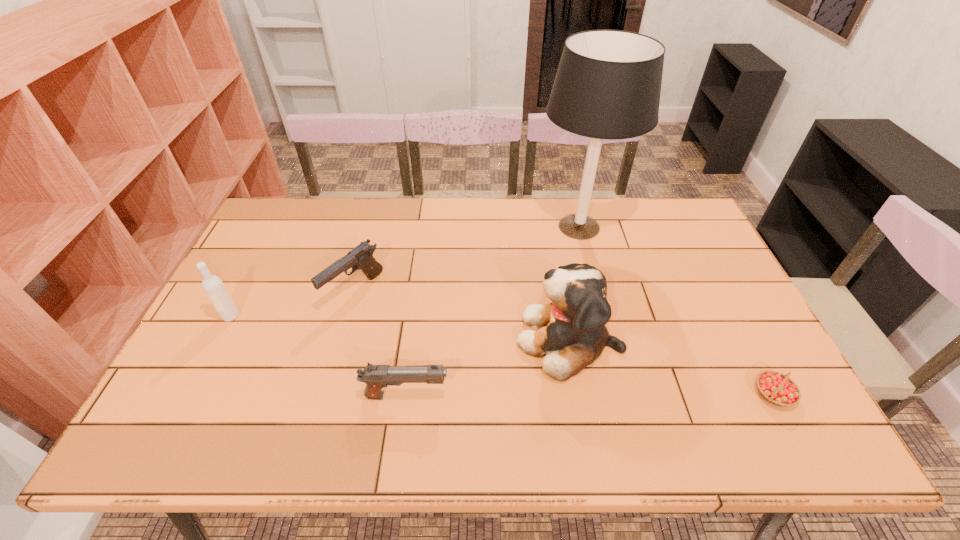
Identify the location of object present at the left edge. (213, 286).

Where is `object located in the right edge section of the desktop`? object located in the right edge section of the desktop is located at coordinates (778, 389).

Identify the location of free space at the far edge of the desktop. The image size is (960, 540). (532, 206).

Locate an element on the screen. free space at the near edge of the desktop is located at coordinates pyautogui.click(x=345, y=440).

Locate an element on the screen. This screenshot has width=960, height=540. vacant area at the left edge is located at coordinates (263, 255).

The height and width of the screenshot is (540, 960). In order to click on vacant area at the right edge of the desktop in this screenshot , I will do click(x=761, y=407).

This screenshot has height=540, width=960. Identify the location of free point at the far left corner. (294, 237).

This screenshot has width=960, height=540. In the image, there is a desktop. What are the coordinates of `vacant space at the near left corner` in the screenshot? It's located at (191, 443).

The width and height of the screenshot is (960, 540). Identify the location of vacant space at the far right corner of the desktop. (644, 198).

Find the location of a particular element. Image resolution: width=960 pixels, height=540 pixels. vacant space that's between the third object from left to right and the third tallest object is located at coordinates (319, 356).